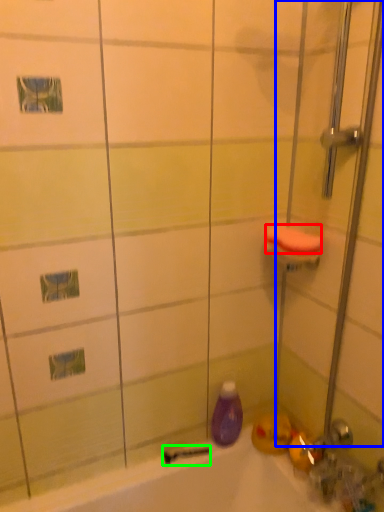
Question: Which is nearer to the soap (highlighted by a red box)? shower door (highlighted by a blue box) or shower (highlighted by a green box).

Choices:
 (A) shower door
 (B) shower

Answer: (A)